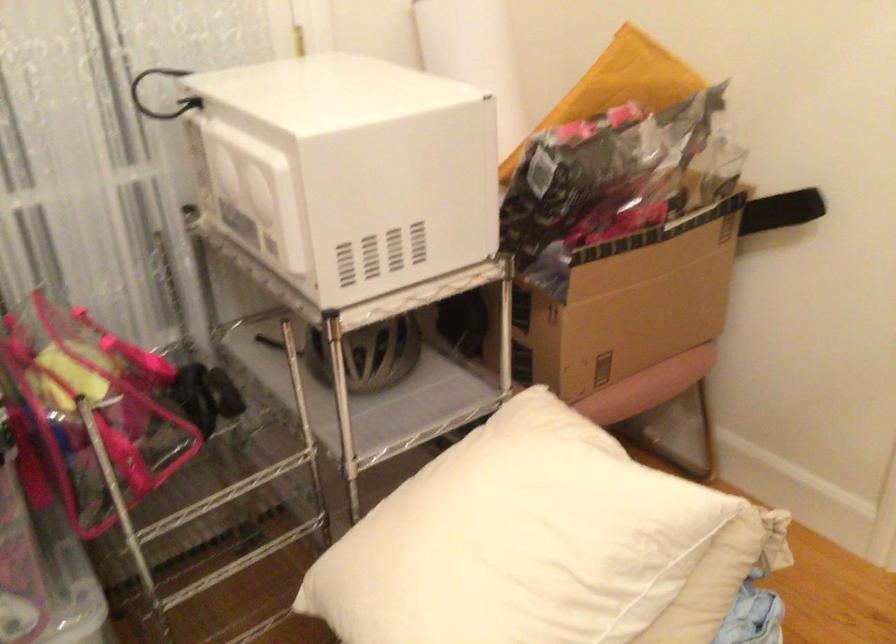
The location [636,312] corresponds to which object?

It corresponds to the cardboard amazon box in the image.